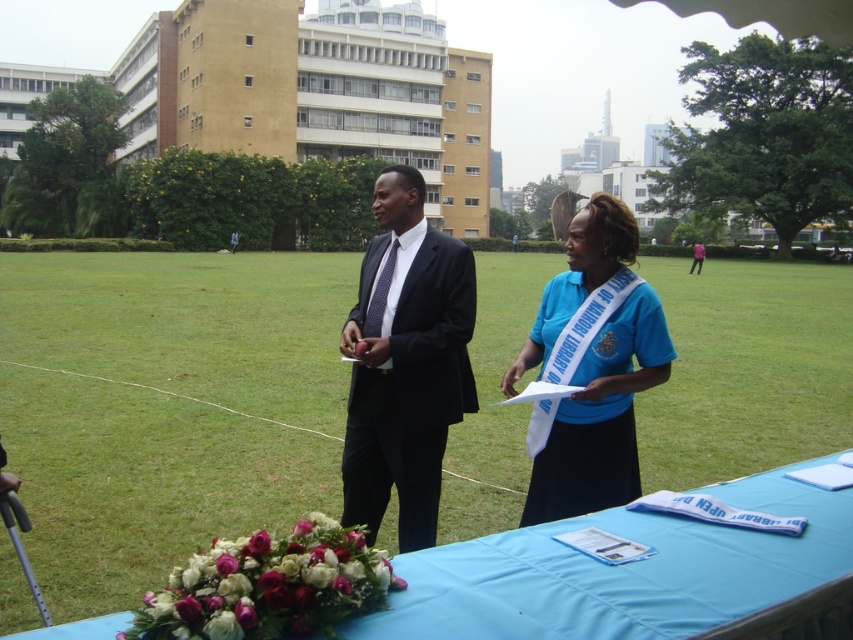
Question: Is matte black suit at center further to camera compared to blue fabric sash at center?

Choices:
 (A) no
 (B) yes

Answer: (B)

Question: Does blue fabric table at center have a greater width compared to blue fabric sash at center?

Choices:
 (A) no
 (B) yes

Answer: (B)

Question: Among these objects, which one is farthest from the camera?

Choices:
 (A) blue fabric table at center
 (B) matte black suit at center
 (C) blue fabric sash at center

Answer: (B)

Question: Is blue fabric table at center bigger than matte black suit at center?

Choices:
 (A) yes
 (B) no

Answer: (B)

Question: Among these objects, which one is farthest from the camera?

Choices:
 (A) blue fabric table at center
 (B) matte black suit at center

Answer: (B)

Question: Which point appears farthest from the camera in this image?

Choices:
 (A) (384, 397)
 (B) (630, 358)
 (C) (839, 536)

Answer: (A)